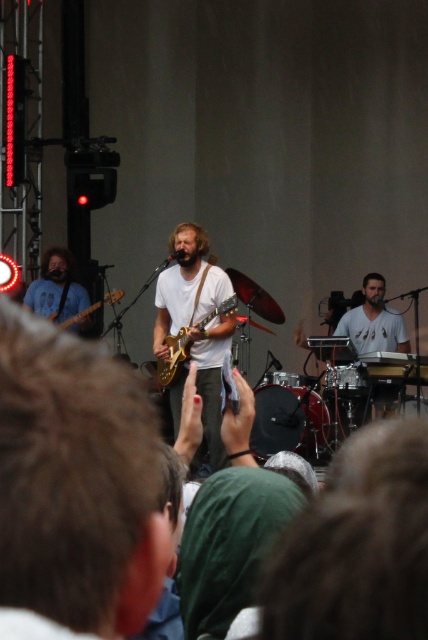
From the picture: You are a photographer trying to capture the best angle of the stage. You notice two points marked on your camera screen at coordinates point (377, 326) and point (73, 328). Which of these points is closer to your camera lens?

Point (377, 326) is closer to the viewer than point (73, 328).

You are a photographer at the concert. You want to capture a wide shot that includes both the white matte shirt at center and the matte blue shirt at left. Which shirt should you focus on to ensure both are in frame?

The white matte shirt at center occupies less space than the matte blue shirt at left, so focusing on the matte blue shirt at left would help ensure both are in frame as it takes up more space and can serve as a reference point for framing.